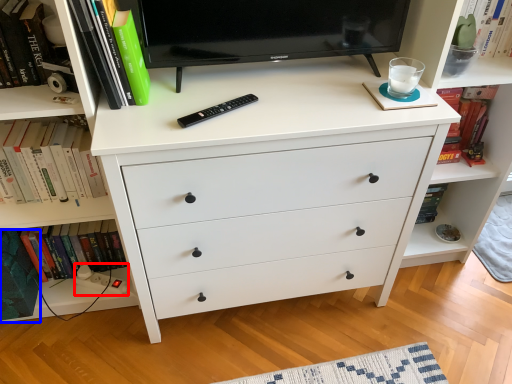
Question: Which point is further to the camera, plug (highlighted by a red box) or paperback book (highlighted by a blue box)?

Choices:
 (A) plug
 (B) paperback book

Answer: (A)